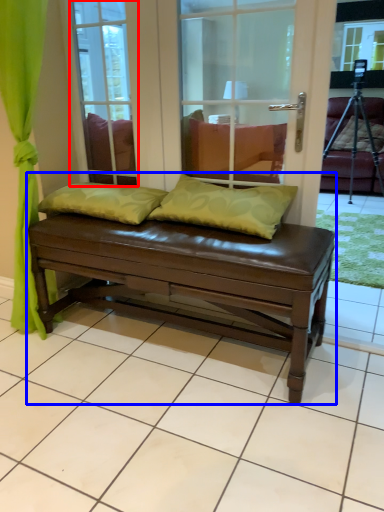
Question: Which point is closer to the camera, glass door (highlighted by a red box) or studio couch (highlighted by a blue box)?

Choices:
 (A) glass door
 (B) studio couch

Answer: (B)